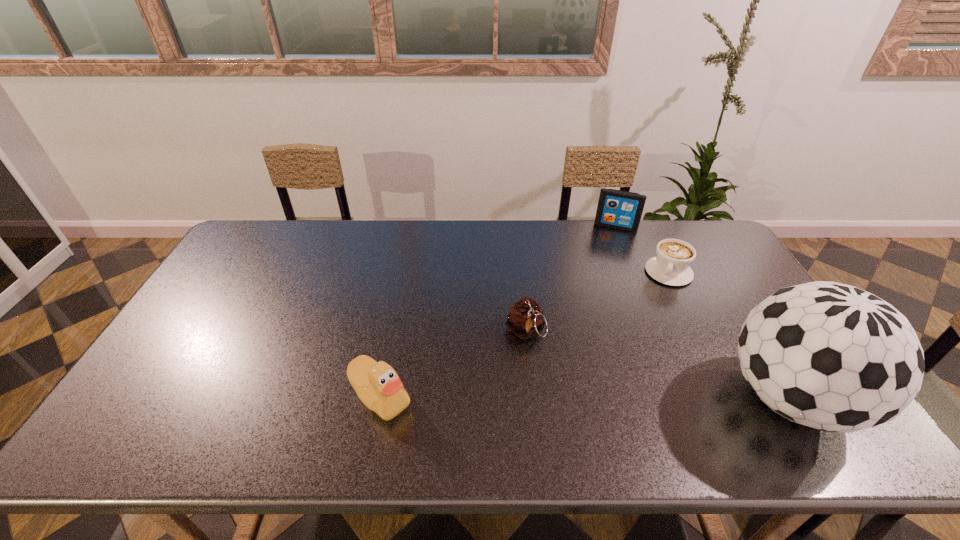
Locate an element on the screen. Image resolution: width=960 pixels, height=540 pixels. vacant space located with a leaf charm attached to the pinecone is located at coordinates (535, 367).

Locate an element on the screen. The image size is (960, 540). vacant space situated to the right of the shortest object's handle is located at coordinates (644, 357).

This screenshot has height=540, width=960. Identify the location of vacant space located 0.120m to the right of the shortest object's handle. coord(658,310).

This screenshot has height=540, width=960. I want to click on free space located to the right of the shortest object's handle, so click(654, 326).

The height and width of the screenshot is (540, 960). I want to click on free space located on the front screen of the farthest object, so click(x=607, y=249).

This screenshot has height=540, width=960. In order to click on free space located 0.260m on the front screen of the farthest object in this screenshot , I will do click(x=600, y=275).

The height and width of the screenshot is (540, 960). In order to click on vacant area situated 0.220m on the front screen of the farthest object in this screenshot , I will do `click(602, 268)`.

I want to click on cappuccino that is at the far edge, so click(x=673, y=257).

Locate an element on the screen. iPod that is at the far edge is located at coordinates [x=618, y=209].

At what (x,y) coordinates should I click in order to perform the action: click on duck present at the near edge. Please return your answer as a coordinate pair (x, y). This screenshot has height=540, width=960. Looking at the image, I should click on (378, 386).